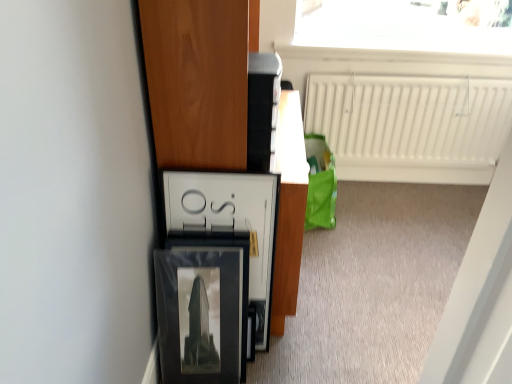
This screenshot has height=384, width=512. What are the coordinates of `free area below white matte radiator at upper right (from a real-world perspective)` in the screenshot? It's located at (410, 190).